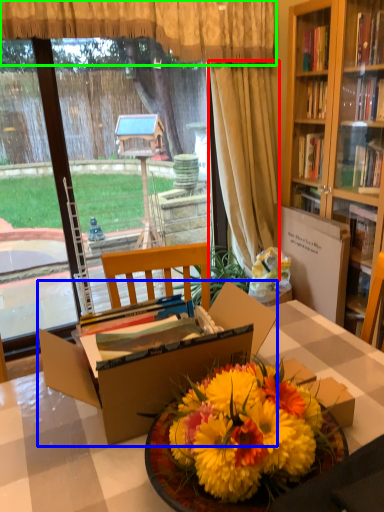
Question: Considering the real-world distances, which object is closest to curtain (highlighted by a red box)? box (highlighted by a blue box) or curtain (highlighted by a green box).

Choices:
 (A) box
 (B) curtain

Answer: (B)